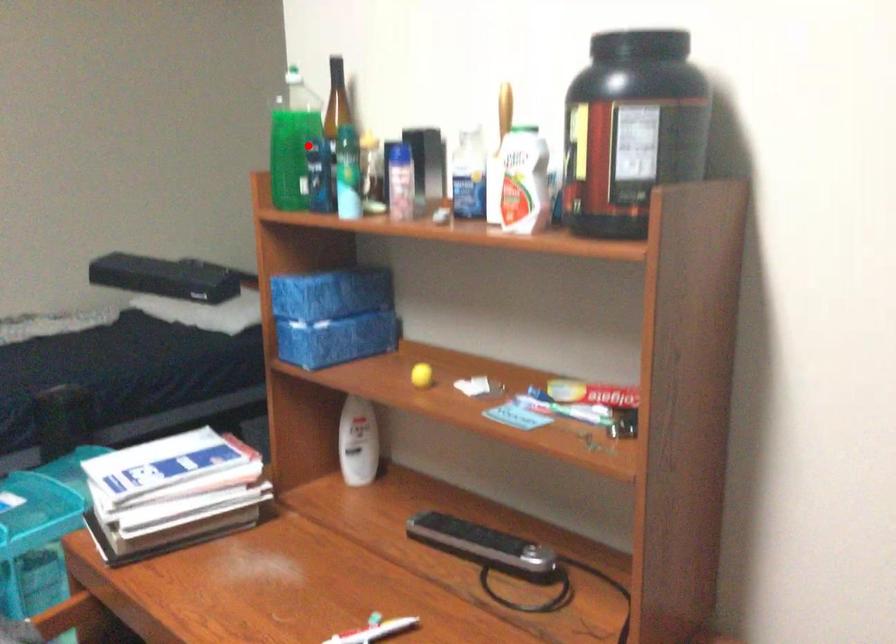
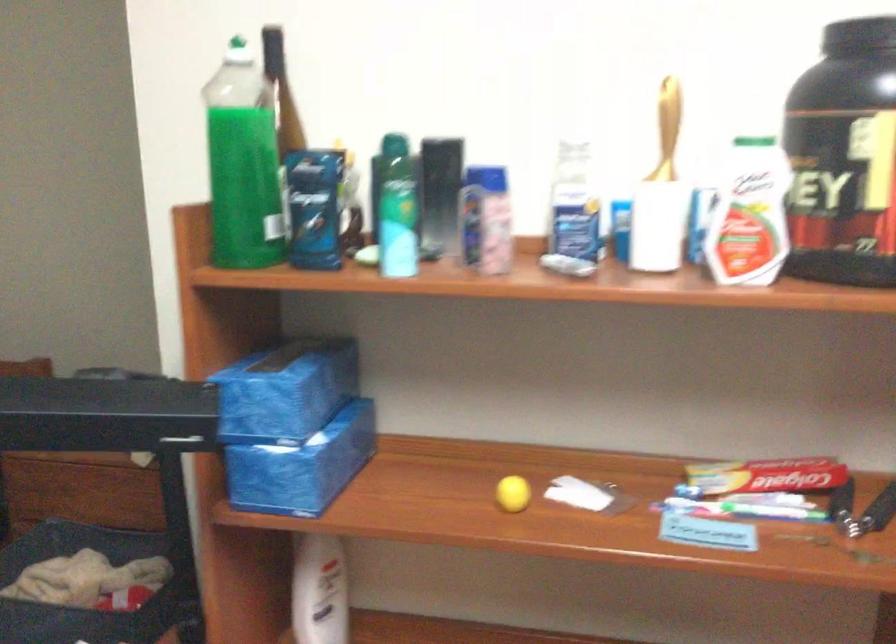
In the second image, find the point that corresponds to the highlighted location in the first image.

(243, 163)